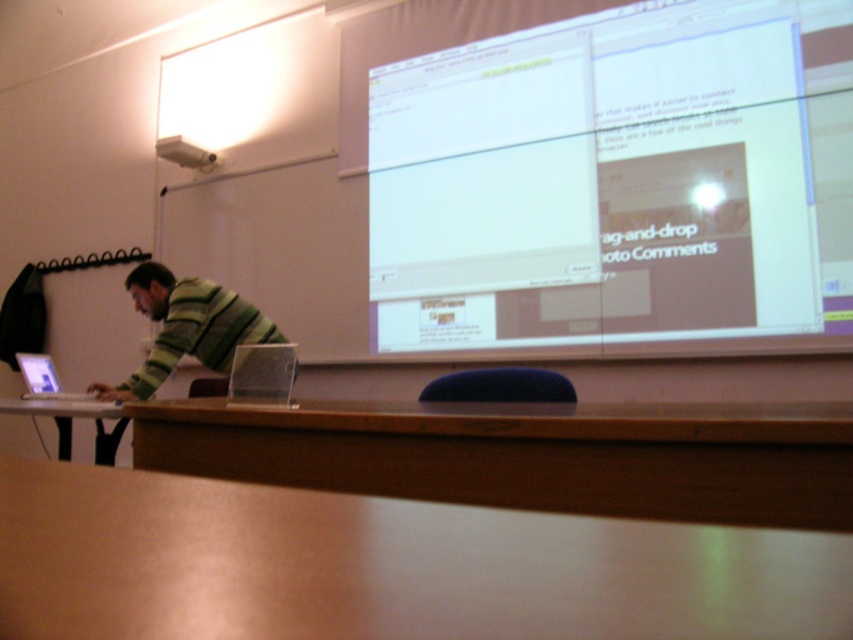
Which of these two, wooden table at lower center or blue fabric chair at center, stands shorter?

Standing shorter between the two is wooden table at lower center.

Can you confirm if wooden table at lower center is positioned to the left of blue fabric chair at center?

Yes, wooden table at lower center is to the left of blue fabric chair at center.

Is point (392, 616) in front of point (434, 385)?

Yes, it is in front of point (434, 385).

Find the location of a particular element. wooden table at lower center is located at coordinates (384, 566).

Is point (109, 464) more distant than point (177, 148)?

No, it is in front of (177, 148).

In the scene shown: Is wooden table at lower left wider than white plastic projector at upper center?

Indeed, wooden table at lower left has a greater width compared to white plastic projector at upper center.

Who is more forward, (39, 403) or (178, 145)?

Point (39, 403) is in front.

The height and width of the screenshot is (640, 853). In order to click on wooden table at lower left in this screenshot , I will do `click(71, 420)`.

Based on the photo, does brown wooden table at lower center come behind blue fabric chair at center?

That is False.

Does point (239, 461) come farther from viewer compared to point (495, 385)?

No, (239, 461) is in front of (495, 385).

What do you see at coordinates (527, 456) in the screenshot? I see `brown wooden table at lower center` at bounding box center [527, 456].

At what (x,y) coordinates should I click in order to perform the action: click on brown wooden table at lower center. Please return your answer as a coordinate pair (x, y). The height and width of the screenshot is (640, 853). Looking at the image, I should click on (527, 456).